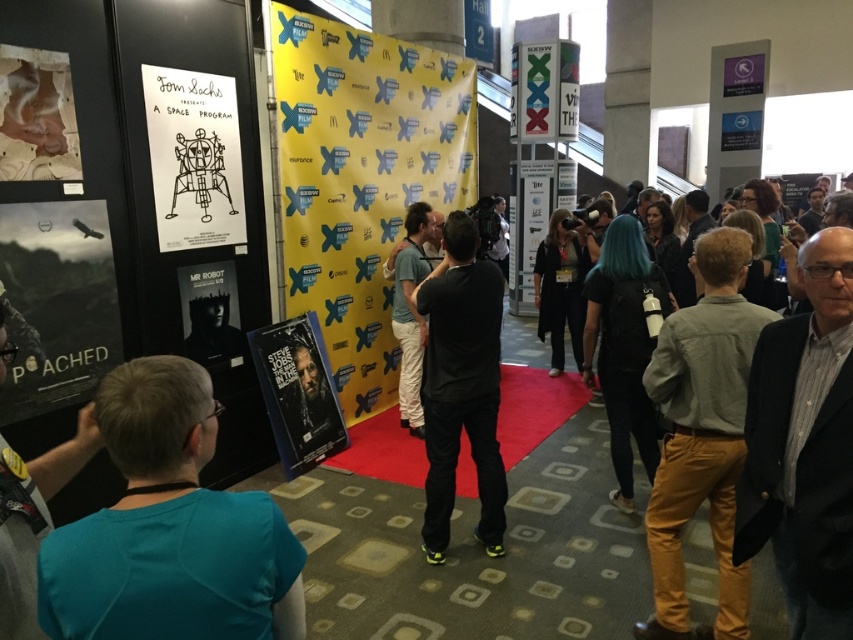
You are a guest at the event and want to take a photo with the dark gray suit jacket at center right and the wooden textured poster at upper left. Since you want both in the frame, which object should you position closer to the camera to ensure both fit vertically?

Since the dark gray suit jacket at center right is taller than the wooden textured poster at upper left, you should position the wooden textured poster at upper left closer to the camera to ensure both fit vertically in the frame.

You are attending a film festival and see the yellow fabric poster at center and the teal shirt at left. Which object is taller?

The yellow fabric poster at center is taller than the teal shirt at left.